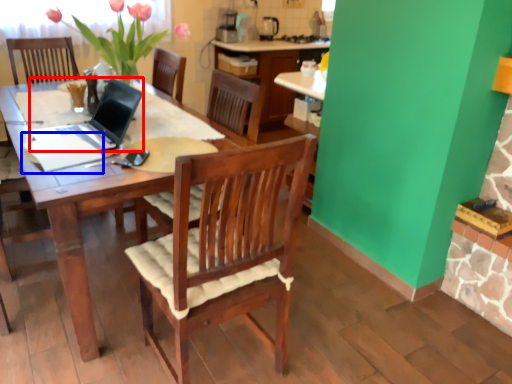
Question: Which point is closer to the camera, laptop (highlighted by a red box) or notepad (highlighted by a blue box)?

Choices:
 (A) laptop
 (B) notepad

Answer: (A)